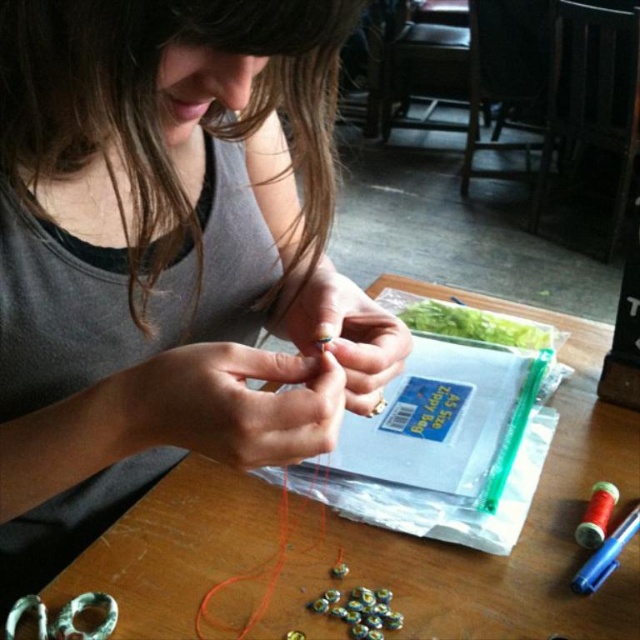
You are organizing a craft fair booth and need to place the matte gray tank top at center and the wooden table at center into storage boxes. The tank top box can only hold items smaller than the wooden table. Will both items fit in their respective boxes?

The matte gray tank top at center is smaller than the wooden table at center, so it will fit in its box. However, the wooden table at center is larger and may not fit in a box meant for smaller items unless a separate, appropriately sized box is used.

You are standing at the edge of the table and want to reach both points. Which point, point (93, 13) or point (604, 595), is closer to you?

Point (93, 13) is closer to you than point (604, 595).